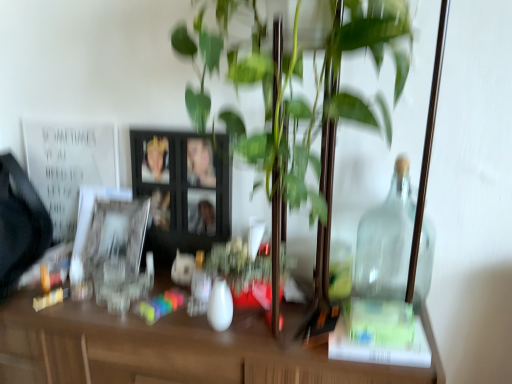
Question: Considering the relative sizes of white glossy picture frame at left, the second picture frame positioned from the right, and green glossy plant at center in the image provided, is white glossy picture frame at left, the second picture frame positioned from the right, smaller than green glossy plant at center?

Choices:
 (A) yes
 (B) no

Answer: (A)

Question: Is white glossy picture frame at left, acting as the first picture frame starting from the left, oriented towards green glossy plant at center?

Choices:
 (A) yes
 (B) no

Answer: (B)

Question: From the image's perspective, would you say white glossy picture frame at left, acting as the first picture frame starting from the left, is shown under green glossy plant at center?

Choices:
 (A) yes
 (B) no

Answer: (A)

Question: Considering the relative sizes of white glossy picture frame at left, the second picture frame positioned from the right, and green glossy plant at center in the image provided, is white glossy picture frame at left, the second picture frame positioned from the right, wider than green glossy plant at center?

Choices:
 (A) yes
 (B) no

Answer: (B)

Question: Are white glossy picture frame at left, acting as the first picture frame starting from the left, and green glossy plant at center located far from each other?

Choices:
 (A) yes
 (B) no

Answer: (B)

Question: Considering the positions of point (393, 241) and point (305, 152), is point (393, 241) closer or farther from the camera than point (305, 152)?

Choices:
 (A) closer
 (B) farther

Answer: (B)

Question: From the image's perspective, is transparent glass jar at right located above or below green glossy plant at center?

Choices:
 (A) above
 (B) below

Answer: (B)

Question: Based on their positions, is transparent glass jar at right located to the left or right of green glossy plant at center?

Choices:
 (A) left
 (B) right

Answer: (B)

Question: From a real-world perspective, is transparent glass jar at right above or below green glossy plant at center?

Choices:
 (A) above
 (B) below

Answer: (B)

Question: From their relative heights in the image, would you say white glossy picture frame at left, the second picture frame positioned from the right, is taller or shorter than white paper at upper left?

Choices:
 (A) tall
 (B) short

Answer: (B)

Question: Is white glossy picture frame at left, acting as the first picture frame starting from the left, spatially inside white paper at upper left, or outside of it?

Choices:
 (A) outside
 (B) inside

Answer: (A)

Question: From the image's perspective, is white glossy picture frame at left, the second picture frame positioned from the right, located above or below white paper at upper left?

Choices:
 (A) above
 (B) below

Answer: (B)

Question: Looking at their shapes, would you say white glossy picture frame at left, the second picture frame positioned from the right, is wider or thinner than white paper at upper left?

Choices:
 (A) wide
 (B) thin

Answer: (A)

Question: Looking at their shapes, would you say green glossy plant at center is wider or thinner than white paper at upper left?

Choices:
 (A) thin
 (B) wide

Answer: (B)

Question: Which is correct: green glossy plant at center is inside white paper at upper left, or outside of it?

Choices:
 (A) inside
 (B) outside

Answer: (B)